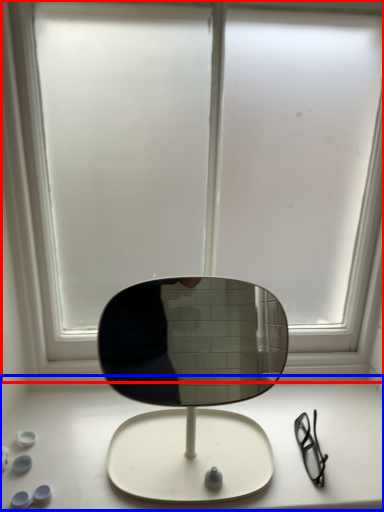
Question: Which point is closer to the camera, window (highlighted by a red box) or table top (highlighted by a blue box)?

Choices:
 (A) window
 (B) table top

Answer: (A)